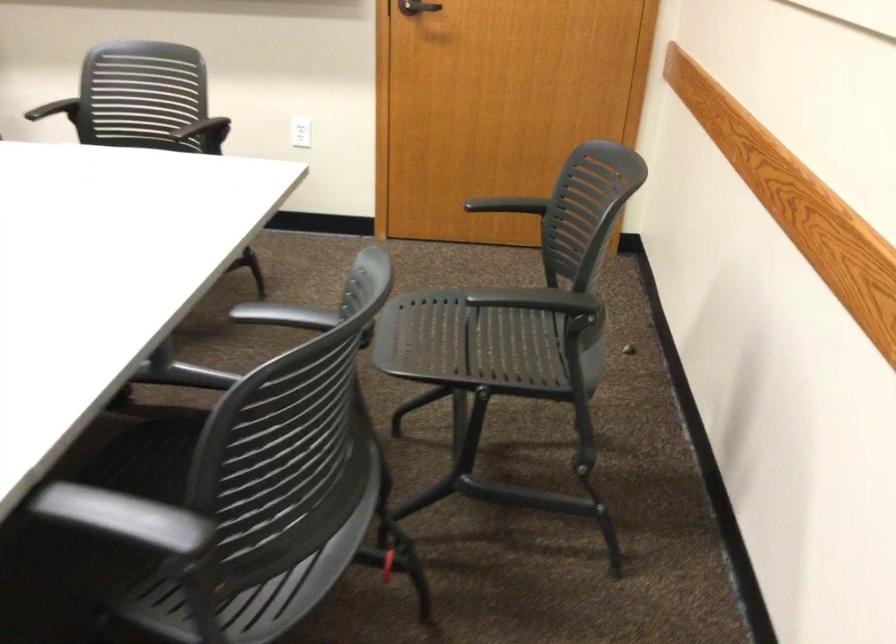
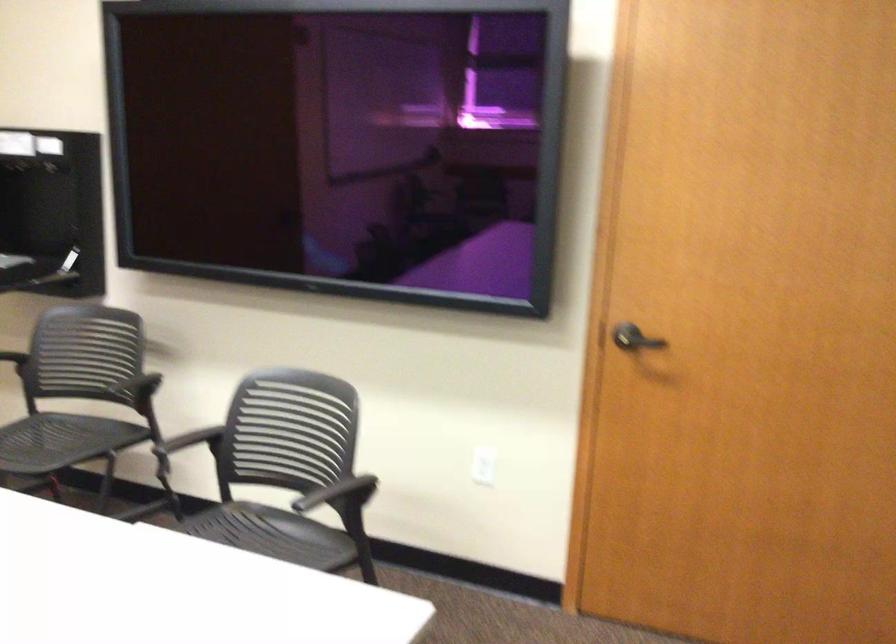
Question: What movement of the cameraman would produce the second image?

Choices:
 (A) Left
 (B) Right
 (C) Forward
 (D) Backward

Answer: (C)